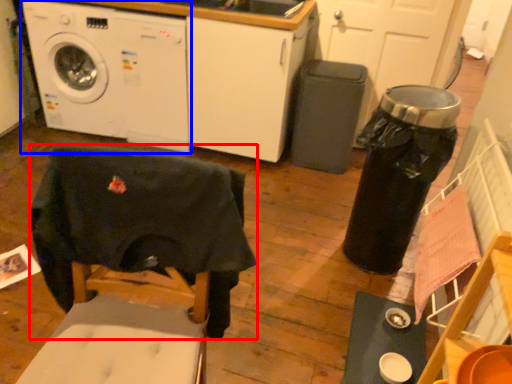
Question: Which object appears farthest to the camera in this image, swivel chair (highlighted by a red box) or washing machine (highlighted by a blue box)?

Choices:
 (A) swivel chair
 (B) washing machine

Answer: (B)